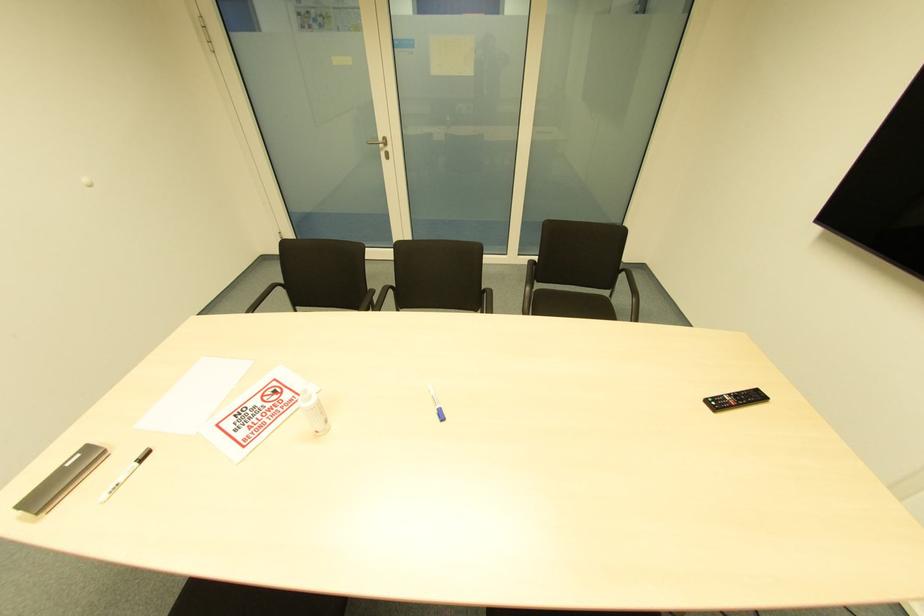
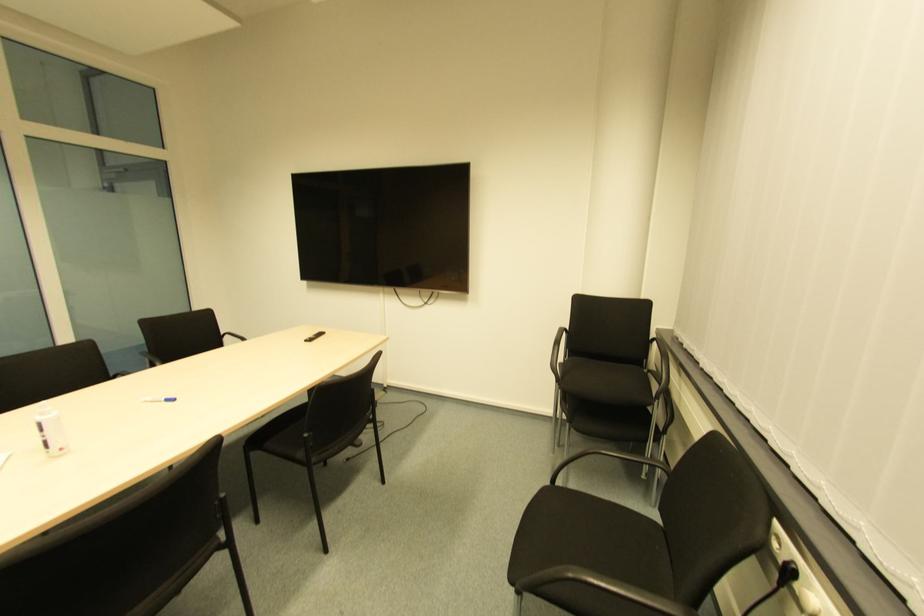
The point at (440, 421) is marked in the first image. Where is the corresponding point in the second image?

(172, 403)